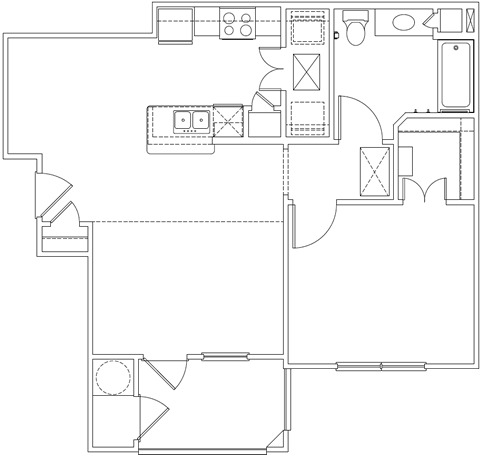
This screenshot has width=483, height=455. Identify the location of sink. (180, 119), (197, 116).